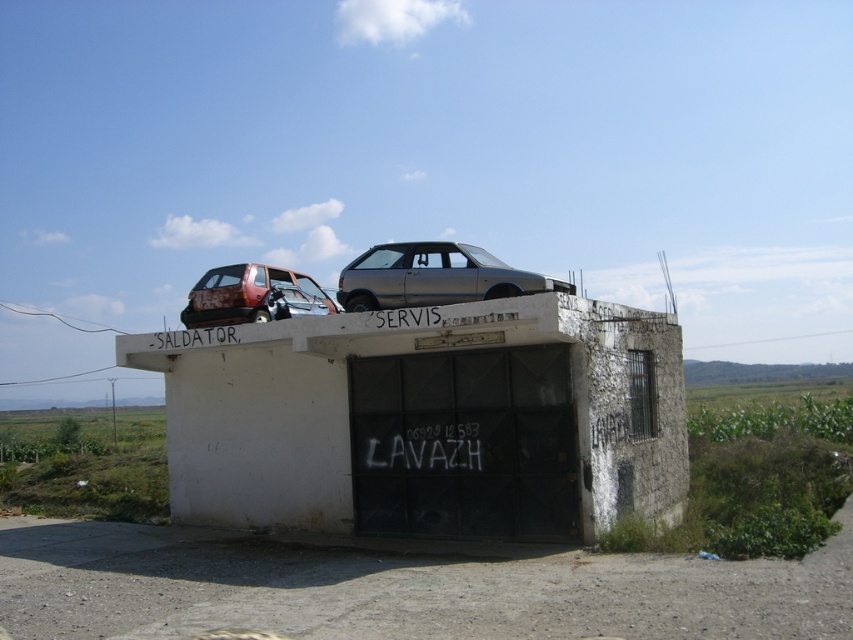
Where is `white concrete bunker at center`? white concrete bunker at center is located at coordinates (427, 419).

Does white concrete bunker at center appear on the left side of metallic gray hatchback at center?

Indeed, white concrete bunker at center is positioned on the left side of metallic gray hatchback at center.

Can you confirm if white concrete bunker at center is taller than metallic gray hatchback at center?

Incorrect, white concrete bunker at center's height is not larger of metallic gray hatchback at center's.

What do you see at coordinates (427, 419) in the screenshot?
I see `white concrete bunker at center` at bounding box center [427, 419].

Locate an element on the screen. The image size is (853, 640). white concrete bunker at center is located at coordinates (427, 419).

Does metallic gray hatchback at center appear on the left side of rusty metal hatchback at upper left?

No, metallic gray hatchback at center is not to the left of rusty metal hatchback at upper left.

Can you confirm if metallic gray hatchback at center is positioned below rusty metal hatchback at upper left?

Actually, metallic gray hatchback at center is above rusty metal hatchback at upper left.

Is point (445, 272) behind point (196, 285)?

No.

Where is `metallic gray hatchback at center`? This screenshot has width=853, height=640. metallic gray hatchback at center is located at coordinates (433, 276).